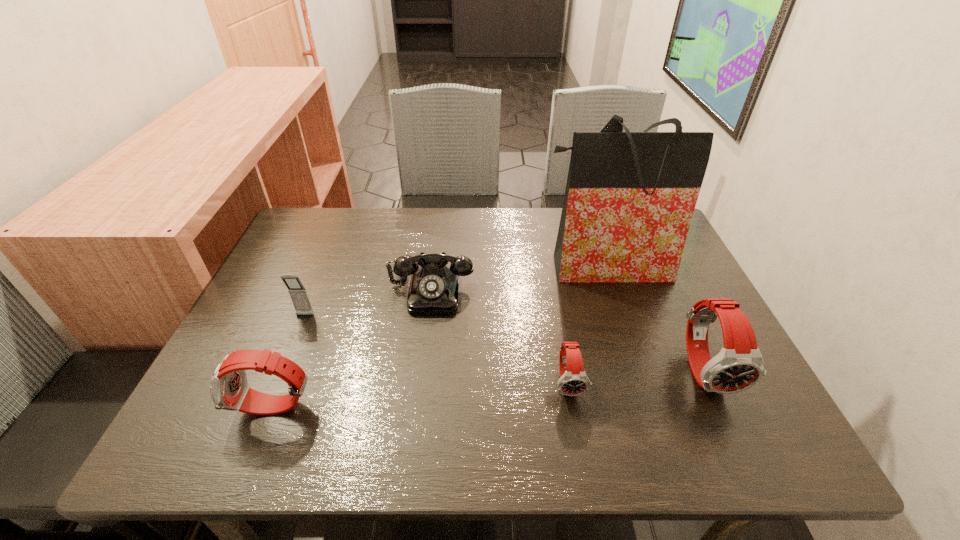
The height and width of the screenshot is (540, 960). Find the location of `vacant space in between the rightmost watch and the third object from left to right`. vacant space in between the rightmost watch and the third object from left to right is located at coordinates (568, 330).

This screenshot has height=540, width=960. I want to click on free space between the cellular telephone and the rightmost watch, so click(505, 343).

Where is `object that is the closest one to the telephone`? The height and width of the screenshot is (540, 960). object that is the closest one to the telephone is located at coordinates (298, 293).

Locate which object is the third closest to the rightmost watch. Please provide its 2D coordinates. Your answer should be formatted as a tuple, i.e. [(x, y)], where the tuple contains the x and y coordinates of a point satisfying the conditions above.

[(434, 288)]

Where is `watch object that ranks as the second closest to the rightmost watch`? watch object that ranks as the second closest to the rightmost watch is located at coordinates (229, 389).

You are a GUI agent. You are given a task and a screenshot of the screen. Output one action in this format:
    pyautogui.click(x=<x>, y=<y>)
    Task: Click on the watch that is the nearest to the tallest object
    
    Given the screenshot: What is the action you would take?
    pyautogui.click(x=739, y=365)

Image resolution: width=960 pixels, height=540 pixels. I want to click on free space that satisfies the following two spatial constraints: 1. on the dial of the telephone; 2. on the face of the leftmost watch, so click(x=417, y=408).

At what (x,y) coordinates should I click in order to perform the action: click on vacant position in the image that satisfies the following two spatial constraints: 1. on the dial of the fourth object from right to left; 2. on the face of the leftmost watch. Please return your answer as a coordinate pair (x, y). Image resolution: width=960 pixels, height=540 pixels. Looking at the image, I should click on (417, 408).

I want to click on vacant space that satisfies the following two spatial constraints: 1. on the front side of the shopping bag; 2. on the face of the second shortest watch, so (x=651, y=408).

What are the coordinates of `free space that satisfies the following two spatial constraints: 1. on the face of the second watch from left to right; 2. on the face of the leftmost watch` in the screenshot? It's located at (573, 408).